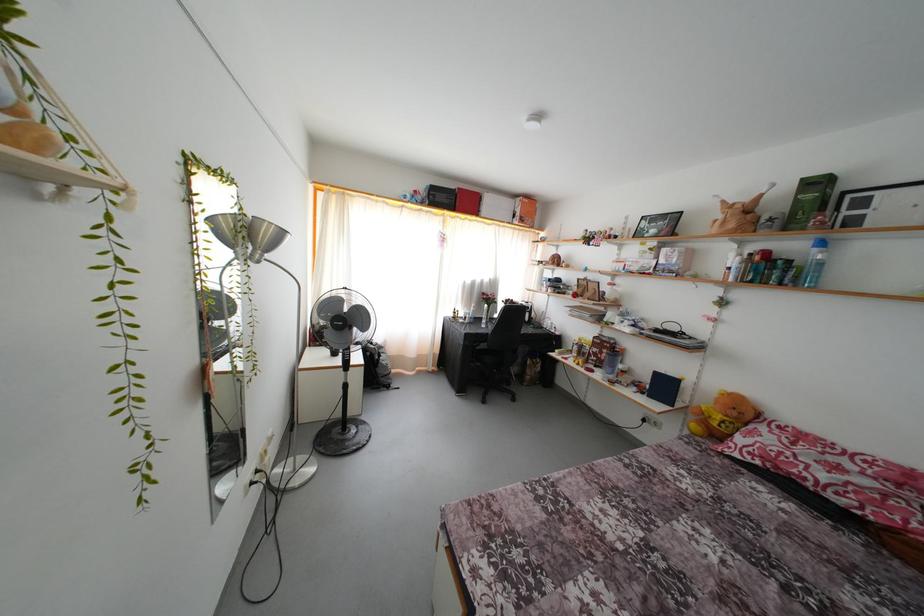
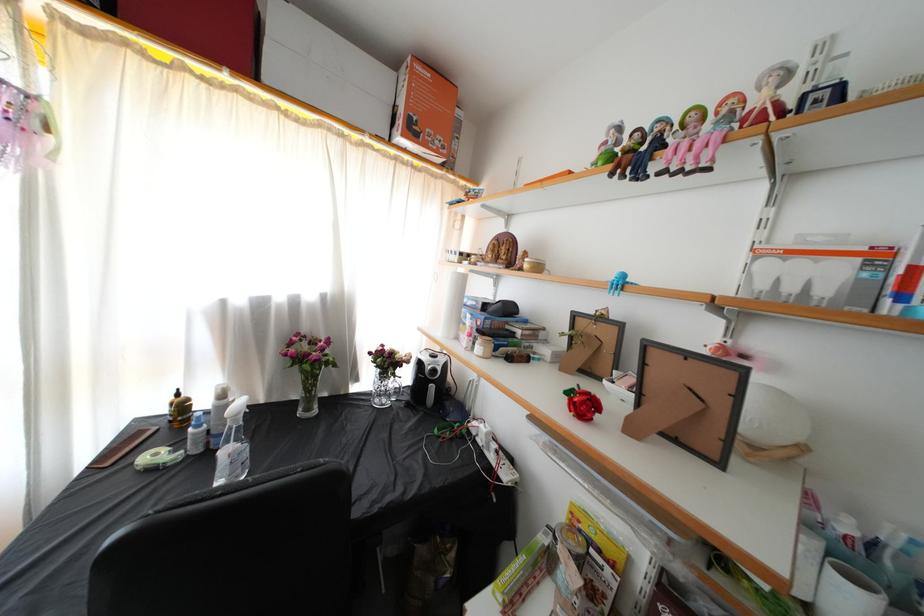
Where in the second image is the point corresponding to point (596, 249) from the first image?

(659, 172)